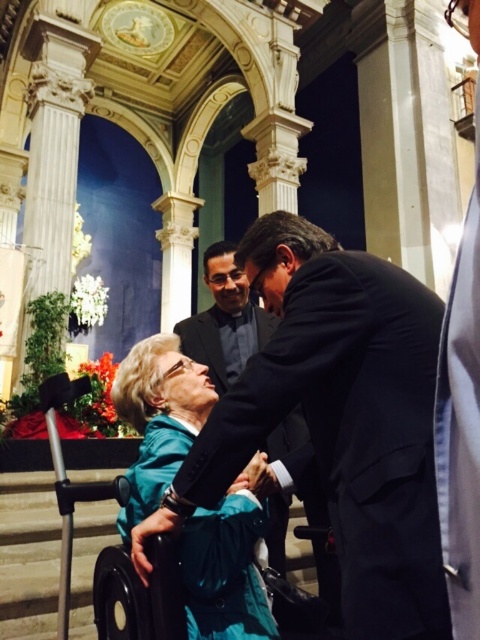
Which is above, teal fabric wheelchair at lower left or black satin suit at center?

black satin suit at center is higher up.

Does teal fabric wheelchair at lower left lie in front of black satin suit at center?

No, it is behind black satin suit at center.

Between point (252, 528) and point (189, 340), which one is positioned behind?

Point (189, 340)

Where is `teal fabric wheelchair at lower left`? teal fabric wheelchair at lower left is located at coordinates (158, 417).

Is point (156, 372) closer to viewer compared to point (256, 484)?

No, (156, 372) is further to viewer.

Identify the location of teal fabric wheelchair at lower left. Image resolution: width=480 pixels, height=640 pixels. (158, 417).

Find the location of a particular element. This screenshot has width=480, height=640. black suit at center is located at coordinates (338, 420).

Who is higher up, black suit at center or black satin suit at center?

black satin suit at center is above.

I want to click on black suit at center, so click(338, 420).

Identify the location of black suit at center. Image resolution: width=480 pixels, height=640 pixels. (338, 420).